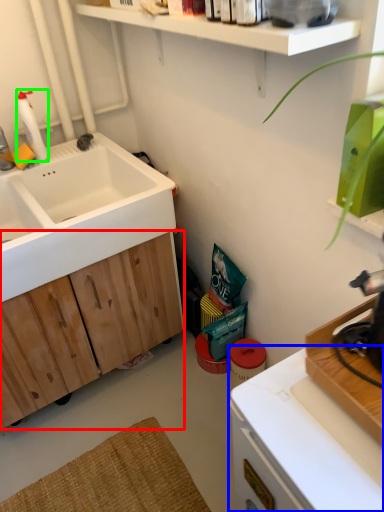
Question: Which is farther away from cabinetry (highlighted by a red box)? countertop (highlighted by a blue box) or cleaning product (highlighted by a green box)?

Choices:
 (A) countertop
 (B) cleaning product

Answer: (A)